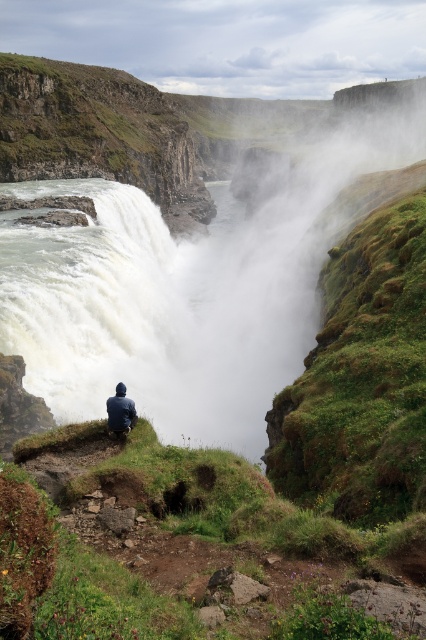
You are a photographer planning to capture a photo of the dark blue jacket at center and the white mist at center at Gullfoss waterfall. Based on the scene, which object appears taller in the image?

The white mist at center appears taller than the dark blue jacket at center in the image.

You are a photographer standing at the viewpoint of Gullfoss waterfall. You notice a dark blue jacket at center and white mist at center in your viewfinder. Which object is positioned to the right of the other?

The white mist at center is to the right of the dark blue jacket at center.